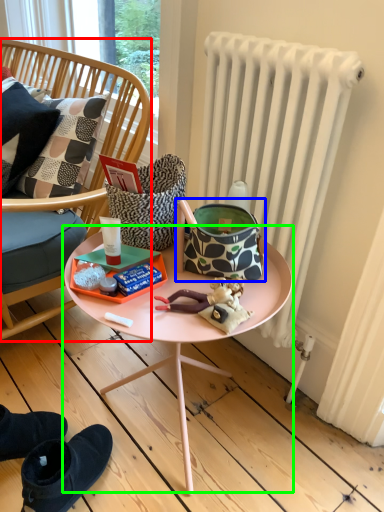
Question: Based on their relative distances, which object is farther from chair (highlighted by a red box)? Choose from handbag (highlighted by a blue box) and table (highlighted by a green box).

Choices:
 (A) handbag
 (B) table

Answer: (A)